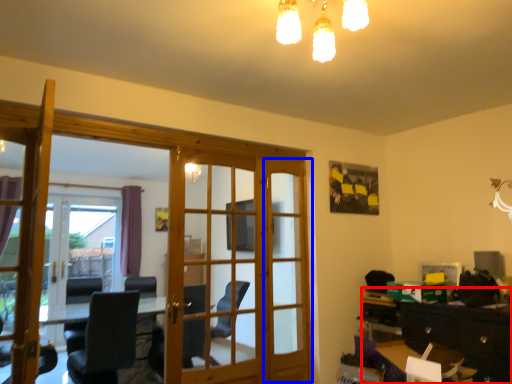
Question: Which object appears farthest to the camera in this image, dresser (highlighted by a red box) or screen door (highlighted by a blue box)?

Choices:
 (A) dresser
 (B) screen door

Answer: (B)